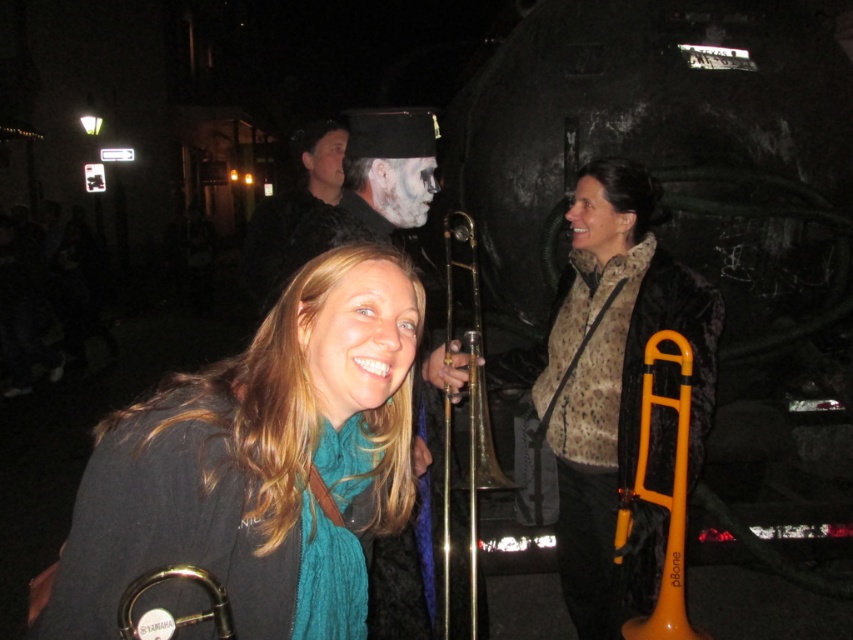
You are a musician who wants to carry both the matte black trombone at center and the orange plastic trombone at center in your arms. Which one should you hold closer to your body to ensure stability?

The matte black trombone at center is wider than the orange plastic trombone at center, so you should hold the matte black trombone at center closer to your body for better stability.

You are a photographer at the event and want to capture both the gold brass trumpet at center and the orange plastic trombone at center in a single photo. Which instrument should you position closer to the camera to ensure both are clearly visible?

The gold brass trumpet at center should be positioned closer to the camera because the orange plastic trombone at center is behind it. By moving the gold brass trumpet forward, both instruments will be in clear view without one blocking the other.

You are a photographer at the event and want to capture the gold brass trumpet at center and orange plastic trombone at center in a single shot. Which instrument will appear closer to the camera in the photo?

The gold brass trumpet at center will appear closer to the camera because it is positioned over the orange plastic trombone at center.